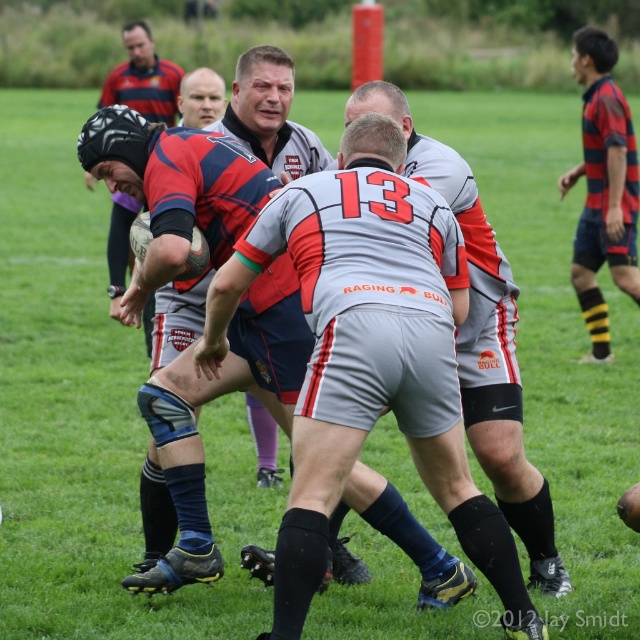
You are a photographer standing at the center of the field, and you want to take a closeup shot of the point at coordinates (371, 326). Given that your camera has a maximum focus range of 15 feet, will you be able to focus on that point?

The distance of point (371, 326) from the camera is 16.49 feet, which exceeds the camera maximum focus range of 15 feet. Therefore, the camera will not be able to focus on that point.